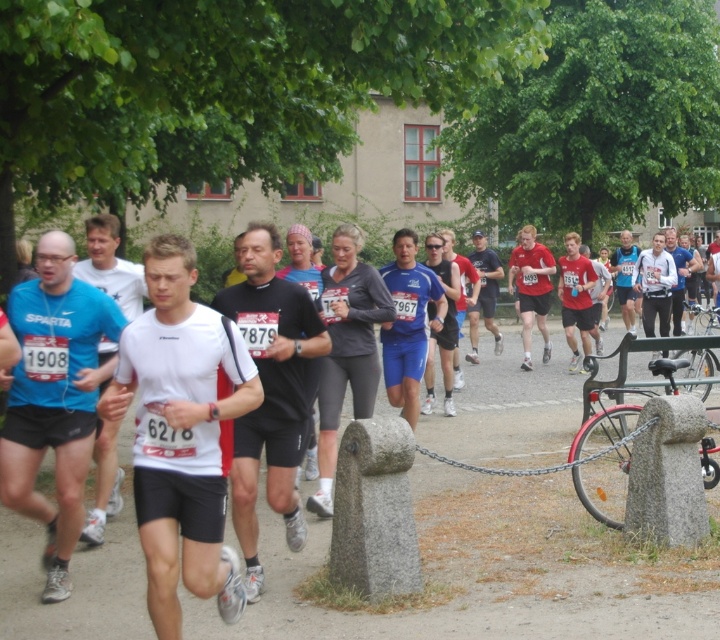
Is point (292, 300) more distant than point (706, 371)?

No, it is not.

Can you confirm if black matte running shoe at center is bigger than silver metallic bicycle at right?

Actually, black matte running shoe at center might be smaller than silver metallic bicycle at right.

Is point (297, 292) positioned in front of point (688, 355)?

Yes.

This screenshot has height=640, width=720. In order to click on black matte running shoe at center in this screenshot , I will do `click(271, 392)`.

Is black matte running shoe at center to the left of red metallic bicycle at lower right from the viewer's perspective?

Indeed, black matte running shoe at center is positioned on the left side of red metallic bicycle at lower right.

Does black matte running shoe at center have a lesser height compared to red metallic bicycle at lower right?

No.

Locate an element on the screen. black matte running shoe at center is located at coordinates (271, 392).

Does red metallic bicycle at lower right have a lesser height compared to silver metallic bicycle at right?

Incorrect, red metallic bicycle at lower right's height does not fall short of silver metallic bicycle at right's.

Find the location of a particular element. The image size is (720, 640). red metallic bicycle at lower right is located at coordinates [x=612, y=435].